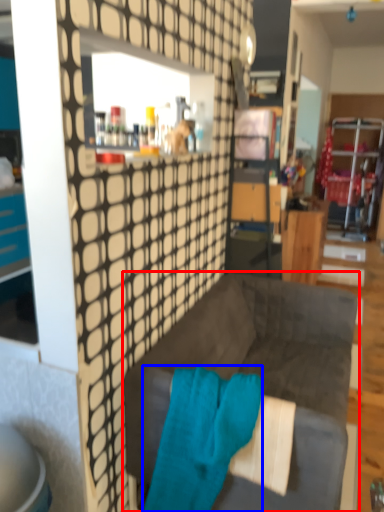
Question: Which of the following is the closest to the observer, studio couch (highlighted by a red box) or bath towel (highlighted by a blue box)?

Choices:
 (A) studio couch
 (B) bath towel

Answer: (B)